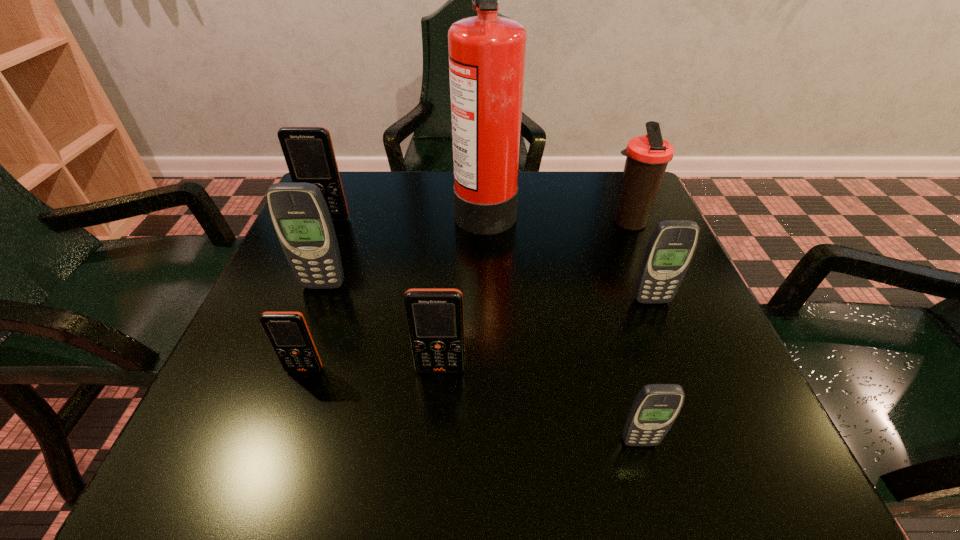
This screenshot has width=960, height=540. Identify the location of red fire extinguisher. (487, 52).

This screenshot has height=540, width=960. Find the location of `fire extinguisher`. fire extinguisher is located at coordinates (487, 52).

The height and width of the screenshot is (540, 960). Find the location of `thermos bottle`. thermos bottle is located at coordinates (647, 158).

Find the location of `the biggest orange cellular telephone`. the biggest orange cellular telephone is located at coordinates (308, 151).

The height and width of the screenshot is (540, 960). I want to click on the farthest orange cellular telephone, so click(308, 151).

The height and width of the screenshot is (540, 960). Identify the location of the biggest gray cellular telephone. (300, 216).

The image size is (960, 540). I want to click on the fourth farthest object, so click(x=300, y=216).

Image resolution: width=960 pixels, height=540 pixels. What are the coordinates of `the second biggest gray cellular telephone` in the screenshot? It's located at (671, 247).

Find the location of a particular element. the rightmost gray cellular telephone is located at coordinates (671, 247).

You are a GUI agent. You are given a task and a screenshot of the screen. Output one action in this format:
    pyautogui.click(x=<x>, y=<y>)
    Task: Click on the rightmost orange cellular telephone
    
    Given the screenshot: What is the action you would take?
    pyautogui.click(x=435, y=320)